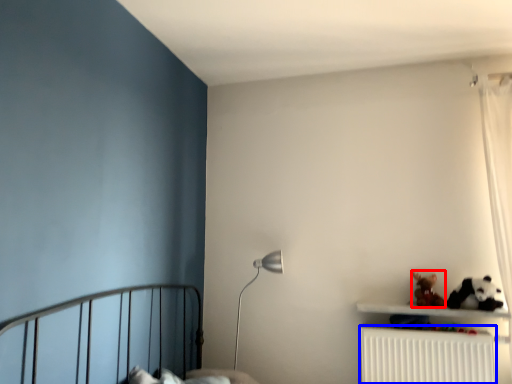
Question: Which object appears farthest to the camera in this image, toy (highlighted by a red box) or radiator (highlighted by a blue box)?

Choices:
 (A) toy
 (B) radiator

Answer: (A)